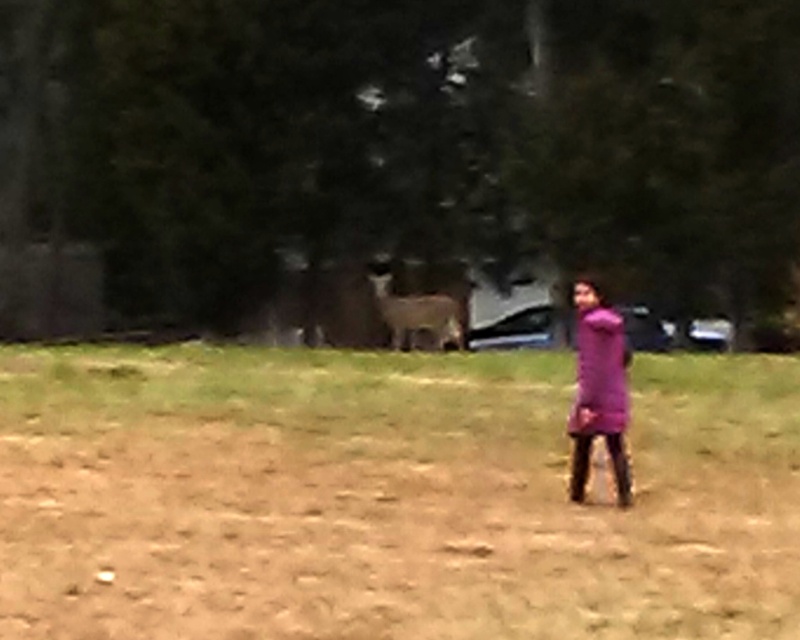
Question: Can you confirm if brown sandy dirt at center is thinner than purple matte dress at center?

Choices:
 (A) yes
 (B) no

Answer: (B)

Question: Where is brown sandy dirt at center located in relation to green grass at center in the image?

Choices:
 (A) left
 (B) right

Answer: (B)

Question: Which of the following is the closest to the observer?

Choices:
 (A) (408, 385)
 (B) (617, 332)
 (C) (774, 481)

Answer: (B)

Question: Which object is closer to the camera taking this photo?

Choices:
 (A) green grass at center
 (B) brown sandy dirt at center

Answer: (B)

Question: Among these objects, which one is nearest to the camera?

Choices:
 (A) green grass at center
 (B) brown sandy dirt at center
 (C) purple matte dress at center

Answer: (B)

Question: Does green grass at center have a lesser width compared to purple matte dress at center?

Choices:
 (A) no
 (B) yes

Answer: (A)